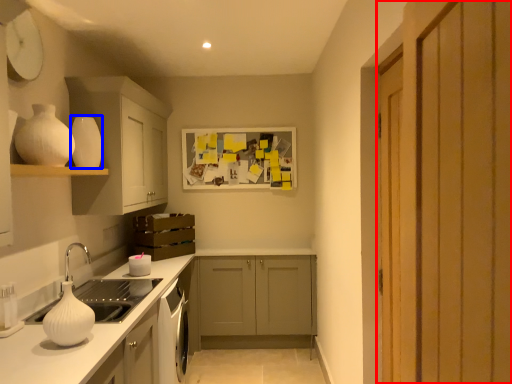
Question: Which point is further to the camera, door (highlighted by a red box) or vase (highlighted by a blue box)?

Choices:
 (A) door
 (B) vase

Answer: (B)